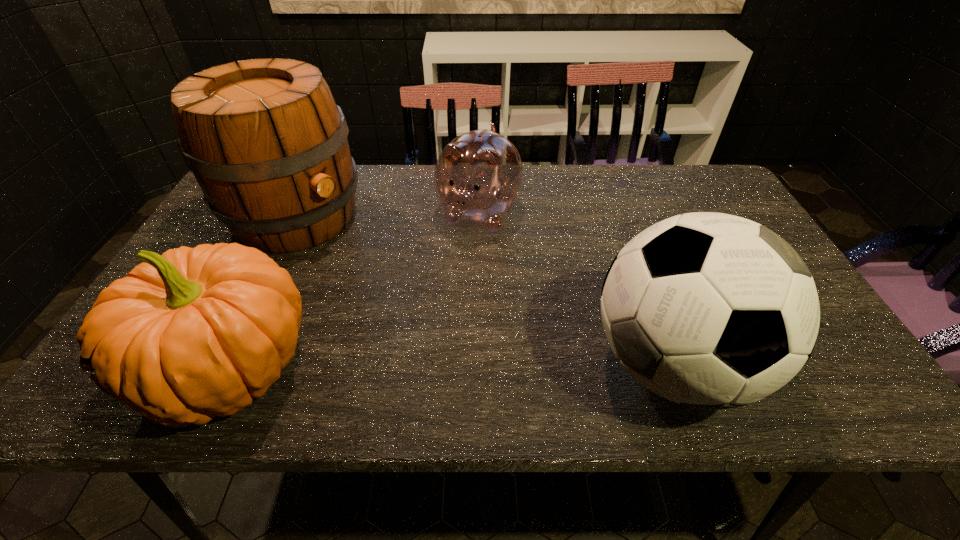
You are a GUI agent. You are given a task and a screenshot of the screen. Output one action in this format:
    pyautogui.click(x=<x>, y=<y>)
    Task: Click on the free spot on the desktop that is between the pumpkin and the rightmost object and is positioned on the side of the cider where the spigot is located
    This screenshot has height=540, width=960.
    Given the screenshot: What is the action you would take?
    pyautogui.click(x=517, y=366)

At what (x,y) coordinates should I click in order to perform the action: click on vacant space on the desktop that is between the pumpkin and the rightmost object and is positioned on the front facing side of the piggy bank. Please return your answer as a coordinate pair (x, y). Image resolution: width=960 pixels, height=540 pixels. Looking at the image, I should click on (393, 368).